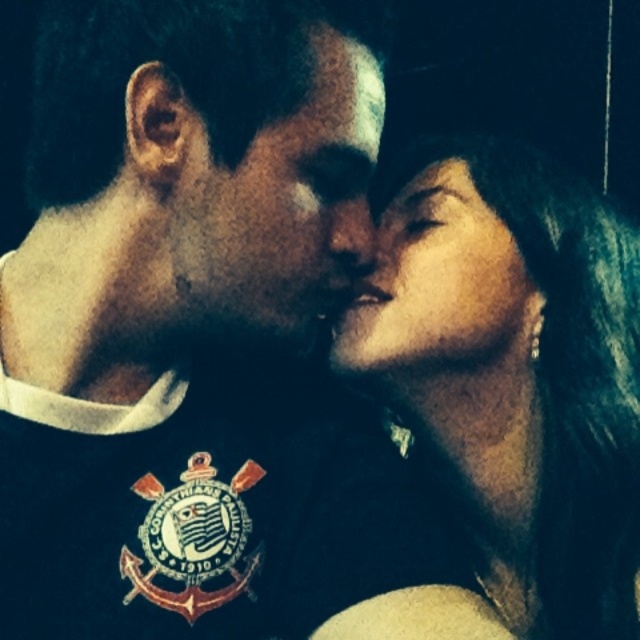
Question: Is matte black face at center to the left of smooth skin face at center from the viewer's perspective?

Choices:
 (A) no
 (B) yes

Answer: (B)

Question: Can you confirm if matte black hair at upper right is positioned to the right of smooth skin face at center?

Choices:
 (A) no
 (B) yes

Answer: (B)

Question: Which point is farther to the camera?

Choices:
 (A) (419, 321)
 (B) (513, 467)

Answer: (B)

Question: Among these objects, which one is farthest from the camera?

Choices:
 (A) matte black face at center
 (B) matte black hair at upper right
 (C) smooth skin face at center

Answer: (C)

Question: Does matte black face at center have a larger size compared to smooth skin face at center?

Choices:
 (A) no
 (B) yes

Answer: (B)

Question: Among these points, which one is farthest from the camera?

Choices:
 (A) (276, 168)
 (B) (502, 236)
 (C) (460, 349)

Answer: (B)